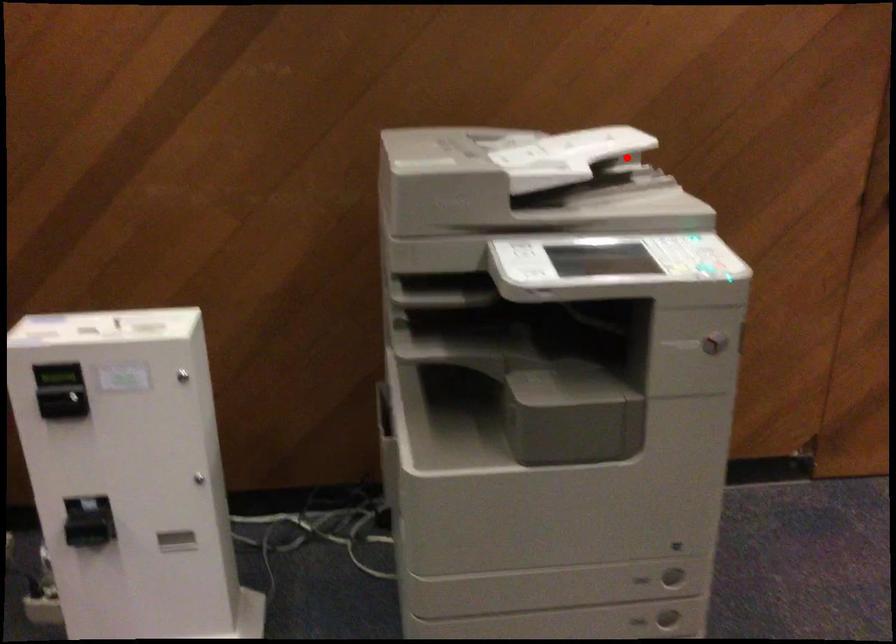
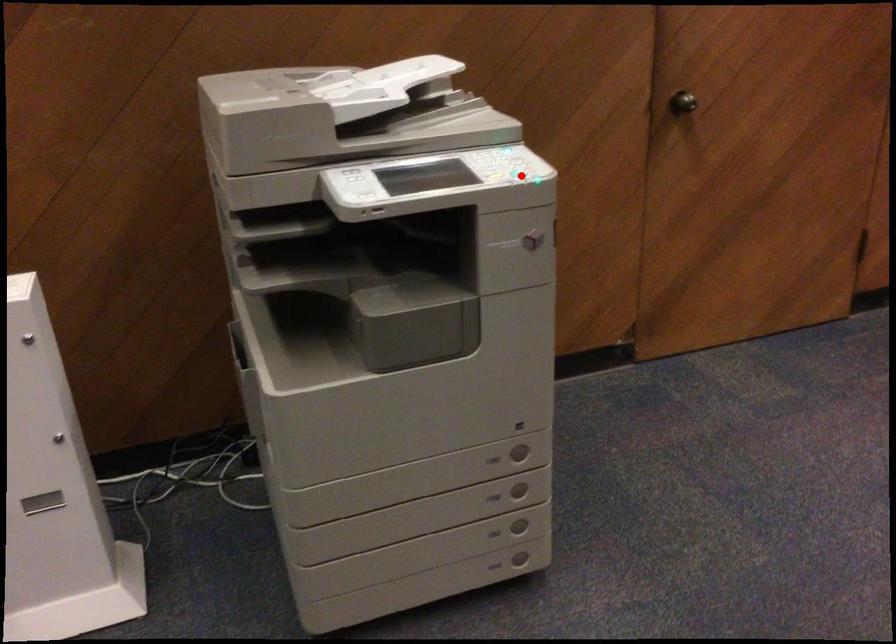
I am providing you with two images of the same scene from different viewpoints. A red point is marked on the first image and another point is marked on the second image. Is the red point in image1 aligned with the point shown in image2?

No